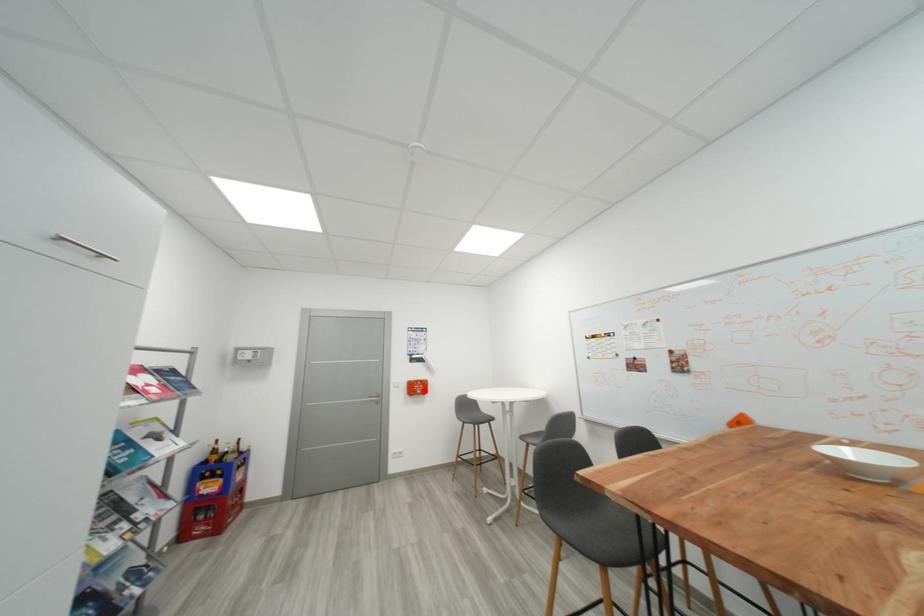
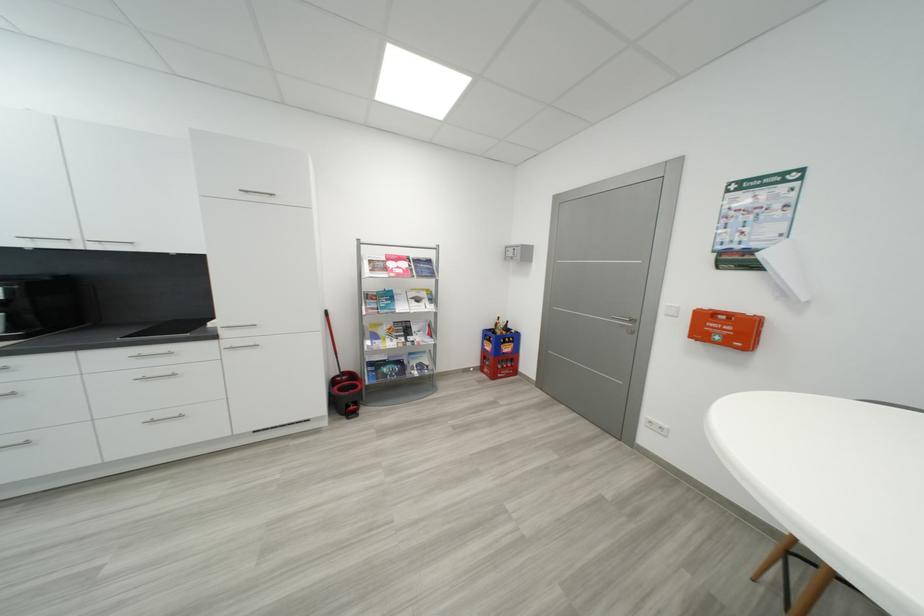
Where in the second image is the point corresponding to the highlighted location from the first image?

(733, 333)